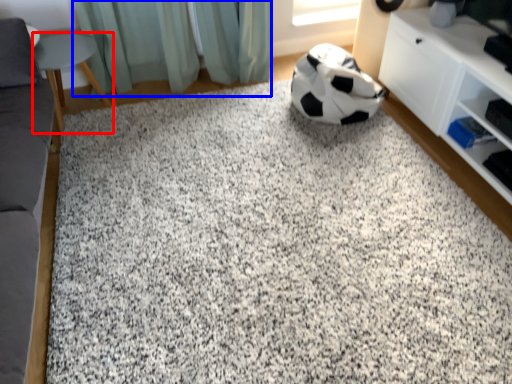
Question: Which object is further to the camera taking this photo, furniture (highlighted by a red box) or curtain (highlighted by a blue box)?

Choices:
 (A) furniture
 (B) curtain

Answer: (B)